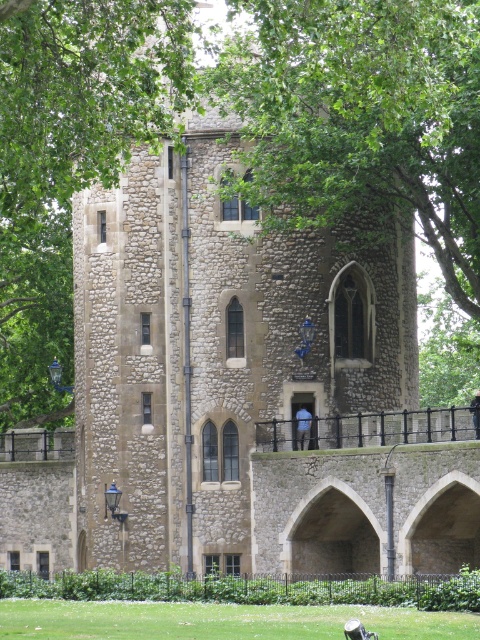
You are standing in front of the historic stone tower and notice the green leafy tree at upper center and the green grass at lower center. Which of these two objects is closer to you?

The green leafy tree at upper center is closer to you because it is in front of the green grass at lower center.

You are standing in front of the historic stone tower and notice a green leafy tree at upper center and a green grass at lower center. Which object is located more to the left side?

The green leafy tree at upper center is positioned more to the left side of the green grass at lower center.

You are a bird looking for a place to land. You see a green leafy tree at upper center and green grass at lower center. Which location would allow you to land closer to the ground?

The green grass at lower center is closer to the ground, so you can land there.